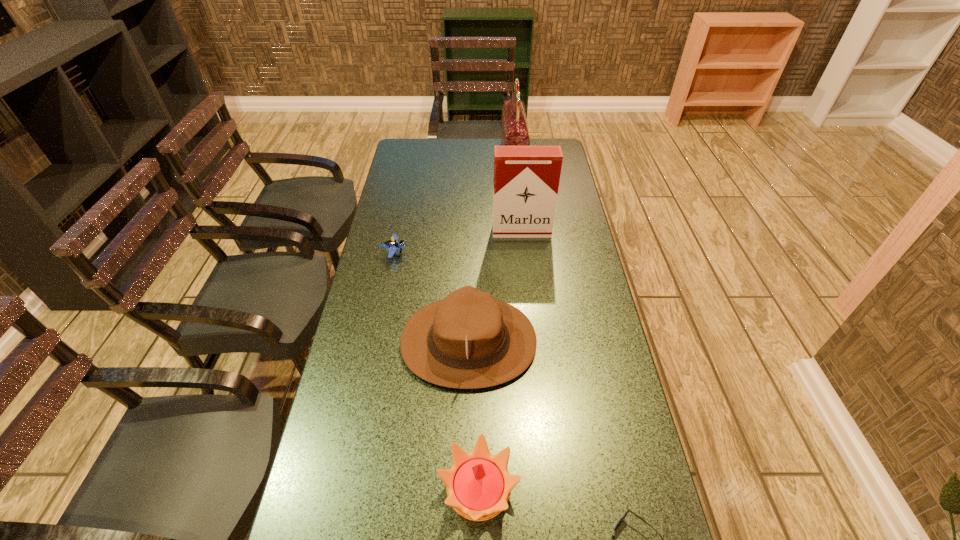
At what (x,y) coordinates should I click in order to perform the action: click on vacant point that satisfies the following two spatial constraints: 1. on the back side of the crown; 2. on the feather side of the third tallest object. Please return your answer as a coordinate pair (x, y). Looking at the image, I should click on (479, 342).

Find the location of a particular element. This screenshot has width=960, height=540. free point that satisfies the following two spatial constraints: 1. on the front-facing side of the cigarette_case; 2. on the feather side of the fedora is located at coordinates (533, 342).